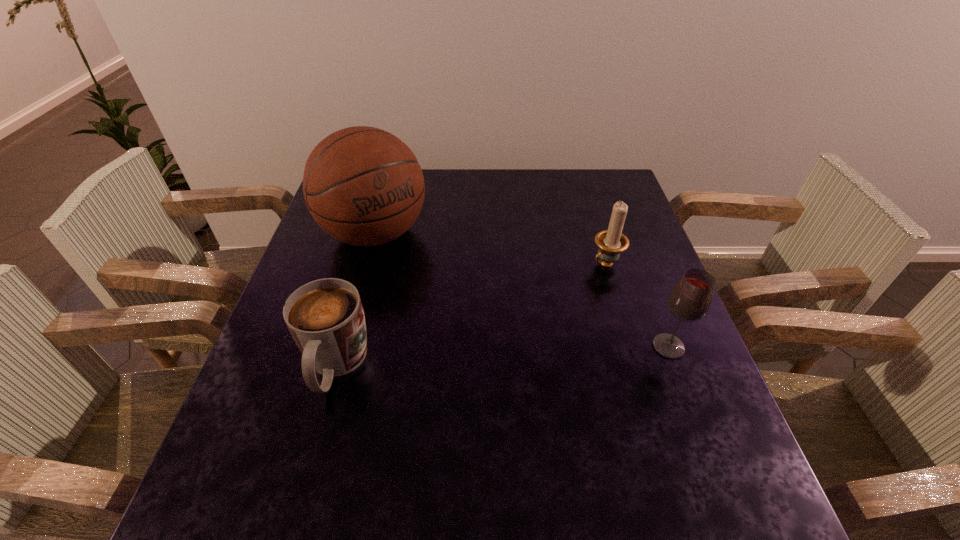
Find the location of a particular element. vacant space at the right edge of the desktop is located at coordinates (643, 363).

Where is `vacant space at the near left corner`? vacant space at the near left corner is located at coordinates (268, 455).

The height and width of the screenshot is (540, 960). Identify the location of vacant space at the far right corner. (616, 178).

Where is `free spot between the glass drink container and the tallest object`? free spot between the glass drink container and the tallest object is located at coordinates (521, 290).

Locate an element on the screen. blank region between the shortest object and the second object from right to left is located at coordinates click(470, 315).

Locate an element on the screen. The image size is (960, 540). free space between the glass drink container and the third object from left to right is located at coordinates (637, 305).

You are a GUI agent. You are given a task and a screenshot of the screen. Output one action in this format:
    pyautogui.click(x=<x>, y=<y>)
    Task: Click on the vacant space in between the basketball and the second object from right to left
    This screenshot has width=960, height=540.
    Given the screenshot: What is the action you would take?
    pyautogui.click(x=491, y=248)

I want to click on free spot between the mug and the rightmost object, so click(x=502, y=356).

Where is `free area in between the rightmost object and the mug`? The height and width of the screenshot is (540, 960). free area in between the rightmost object and the mug is located at coordinates (502, 356).

Locate an element on the screen. object that stands as the third closest to the mug is located at coordinates (690, 299).